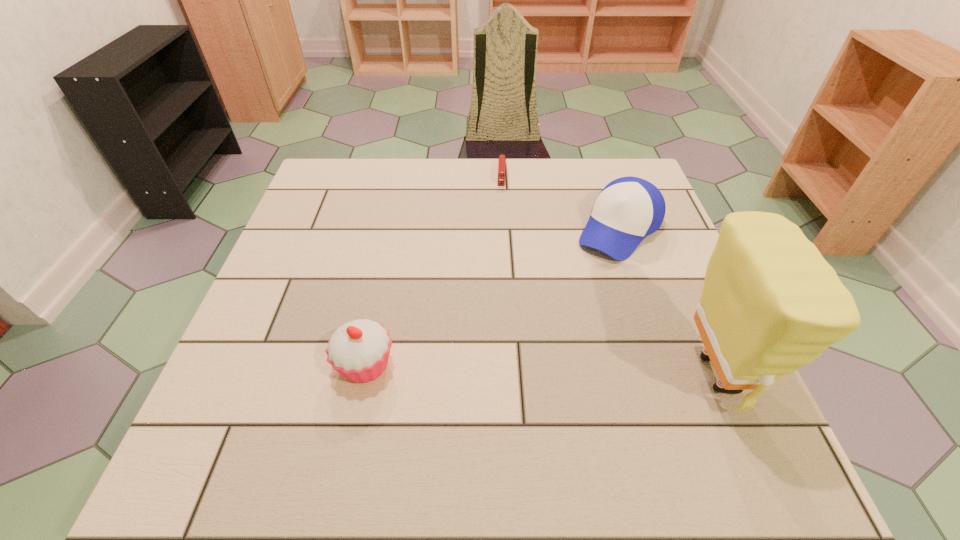
At what (x,y) coordinates should I click in order to perform the action: click on the leftmost object. Please return your answer as a coordinate pair (x, y). Looking at the image, I should click on (359, 350).

Locate an element on the screen. Image resolution: width=960 pixels, height=540 pixels. sponge is located at coordinates (771, 304).

The height and width of the screenshot is (540, 960). Find the location of `baseball cap`. baseball cap is located at coordinates (628, 209).

Find the location of a particular element. The height and width of the screenshot is (540, 960). the shortest object is located at coordinates (502, 159).

The image size is (960, 540). I want to click on the farthest object, so click(x=502, y=159).

Identify the location of vacant region located on the back of the leftmost object. (378, 306).

At what (x,y) coordinates should I click in order to perform the action: click on vacant region located on the front-facing side of the baseball cap. Please return your answer as a coordinate pair (x, y). Looking at the image, I should click on (505, 363).

This screenshot has width=960, height=540. Find the location of `free spot located 0.240m on the front-facing side of the baseball cap`. free spot located 0.240m on the front-facing side of the baseball cap is located at coordinates (545, 318).

Locate an element on the screen. This screenshot has width=960, height=540. vacant area located 0.300m on the front-facing side of the baseball cap is located at coordinates (529, 336).

The height and width of the screenshot is (540, 960). In order to click on free space located on the front-facing side of the farthest object in this screenshot , I will do `click(498, 275)`.